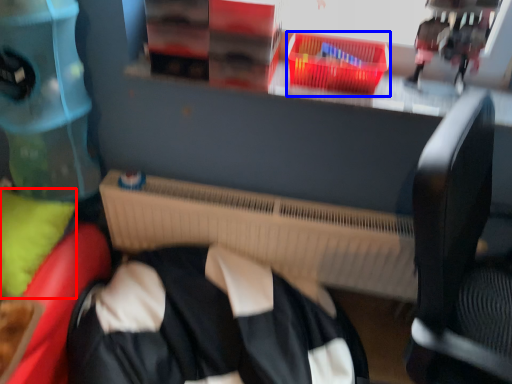
Question: Which object appears farthest to the camera in this image, pillow (highlighted by a red box) or basket (highlighted by a blue box)?

Choices:
 (A) pillow
 (B) basket

Answer: (B)